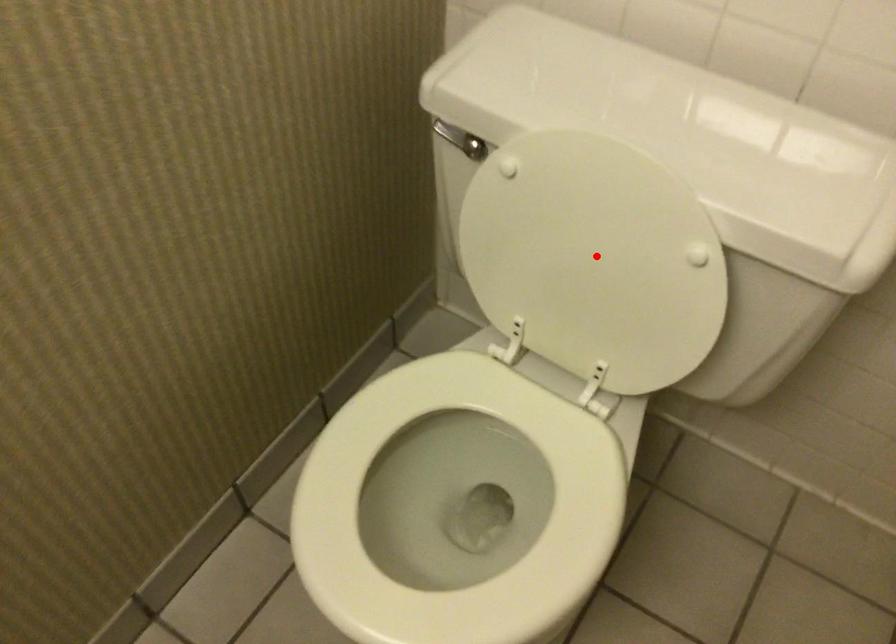
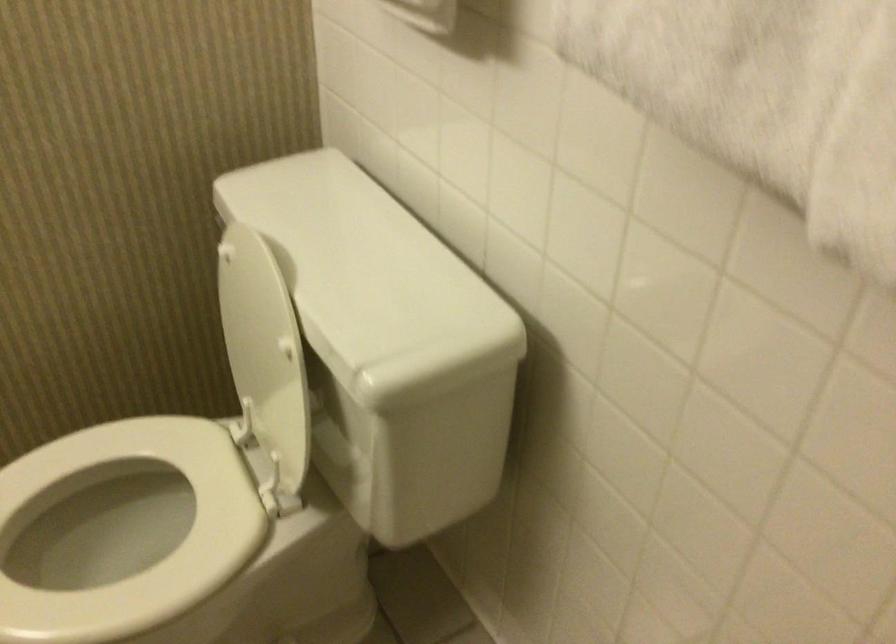
Question: I am providing you with two images of the same scene from different viewpoints. A red point is marked on the first image. Can you still see the location of the red point in image 2?

Choices:
 (A) Yes
 (B) No

Answer: (A)